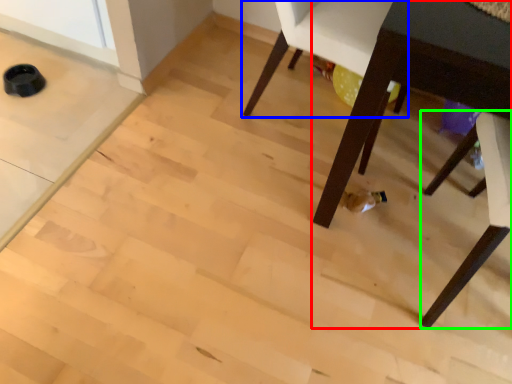
Question: Based on their relative distances, which object is farther from table (highlighted by a red box)? Choose from chair (highlighted by a blue box) and chair (highlighted by a green box).

Choices:
 (A) chair
 (B) chair

Answer: (A)